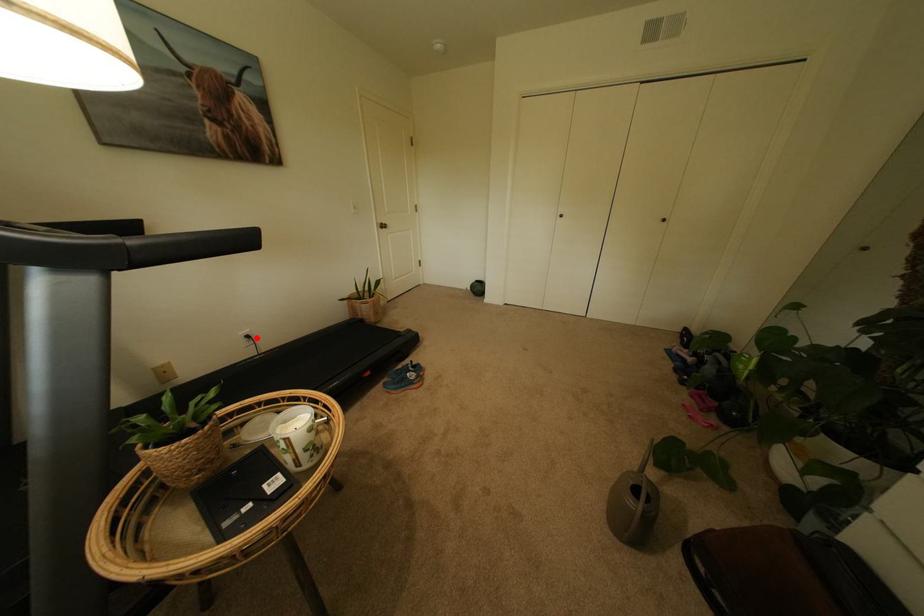
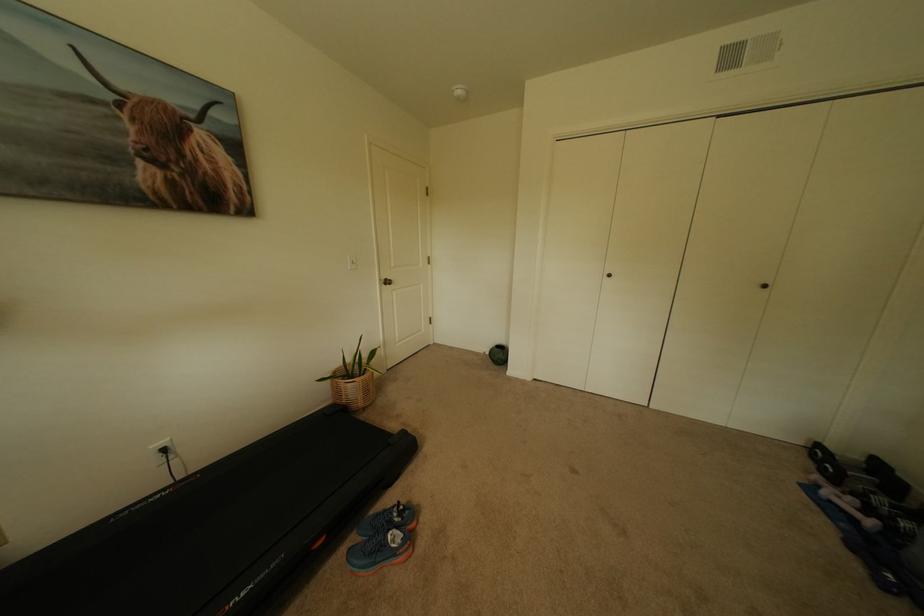
The point at the highlighted location is marked in the first image. Where is the corresponding point in the second image?

(173, 451)